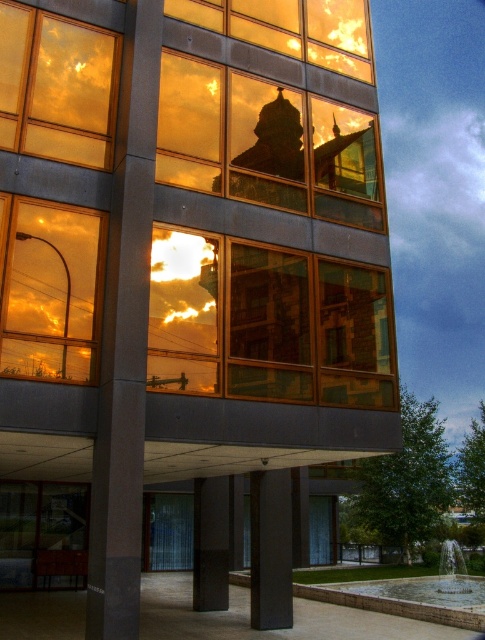
Who is more forward, (7, 328) or (33, 147)?

Point (7, 328) is more forward.

Which is more to the left, golden reflective glass window at left or matte glass window at upper left?

Positioned to the left is matte glass window at upper left.

Which is in front, point (66, 368) or point (28, 24)?

Point (66, 368) is more forward.

What are the coordinates of `golden reflective glass window at left` in the screenshot? It's located at (50, 289).

Does matte glass window at upper left have a smaller size compared to transparent glass door at lower center?

Yes.

What do you see at coordinates (57, 86) in the screenshot?
I see `matte glass window at upper left` at bounding box center [57, 86].

Where is `matte glass window at upper left`? This screenshot has height=640, width=485. matte glass window at upper left is located at coordinates (57, 86).

Does point (50, 22) lie behind point (420, 620)?

No, it is in front of (420, 620).

Who is positioned more to the right, matte glass window at upper left or smooth concrete fountain at lower center?

smooth concrete fountain at lower center is more to the right.

Where is `matte glass window at upper left`? The height and width of the screenshot is (640, 485). matte glass window at upper left is located at coordinates (57, 86).